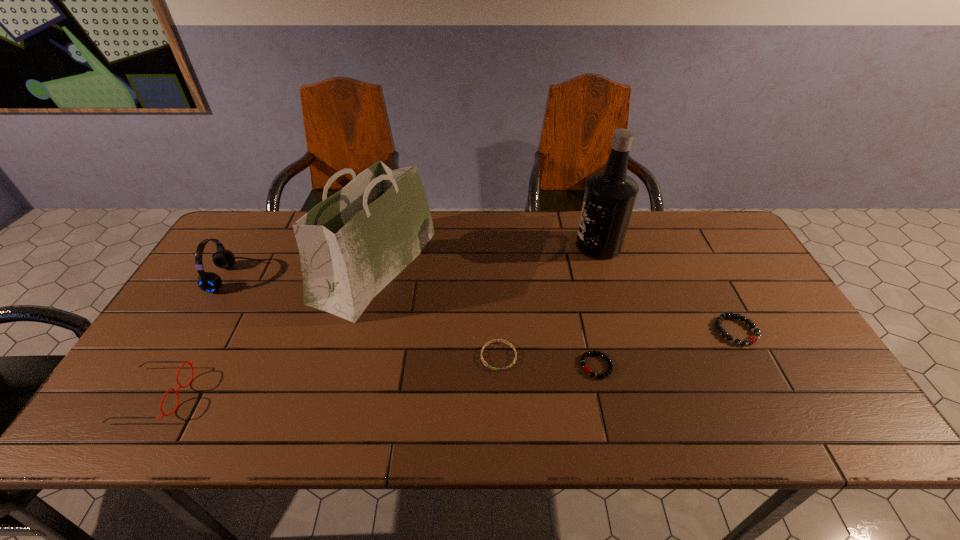
Find the location of a particular element. The height and width of the screenshot is (540, 960). liquor is located at coordinates (609, 197).

Find the location of a particular element. This screenshot has width=960, height=540. the third object from left to right is located at coordinates (353, 244).

The height and width of the screenshot is (540, 960). Find the location of `grocery bag`. grocery bag is located at coordinates (353, 244).

I want to click on headset, so click(x=209, y=282).

In order to click on spectacles in this screenshot , I will do `click(180, 386)`.

At what (x,y) coordinates should I click in order to perform the action: click on the fifth tallest object. Please return your answer as a coordinate pair (x, y). The image size is (960, 540). Looking at the image, I should click on (751, 339).

Locate an element on the screen. This screenshot has width=960, height=540. the rightmost object is located at coordinates (751, 339).

The image size is (960, 540). I want to click on the second bracelet from right to left, so click(586, 368).

This screenshot has width=960, height=540. I want to click on the leftmost bracelet, so click(x=489, y=342).

You are a GUI agent. You are given a task and a screenshot of the screen. Output one action in this format:
    pyautogui.click(x=<x>, y=<y>)
    Task: Click on the vacant space located on the front label of the tallest object
    The width and height of the screenshot is (960, 540).
    Given the screenshot: What is the action you would take?
    pyautogui.click(x=491, y=245)